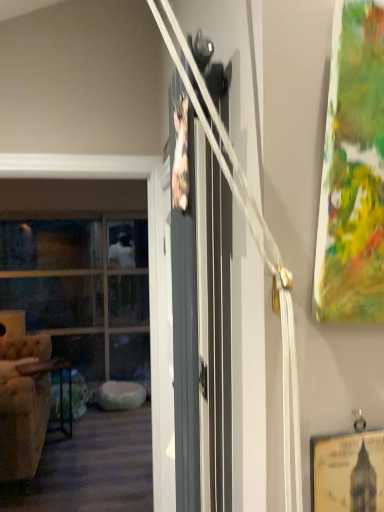
Question: Is metallic dark brown table at left to the left of clear glass window at left from the viewer's perspective?

Choices:
 (A) yes
 (B) no

Answer: (B)

Question: Considering the relative sizes of metallic dark brown table at left and clear glass window at left in the image provided, is metallic dark brown table at left wider than clear glass window at left?

Choices:
 (A) no
 (B) yes

Answer: (A)

Question: From the image's perspective, does metallic dark brown table at left appear lower than clear glass window at left?

Choices:
 (A) no
 (B) yes

Answer: (B)

Question: Does metallic dark brown table at left come in front of clear glass window at left?

Choices:
 (A) yes
 (B) no

Answer: (A)

Question: From the image's perspective, is metallic dark brown table at left on top of clear glass window at left?

Choices:
 (A) yes
 (B) no

Answer: (B)

Question: Do you think clear glass window at left is within matte gray barn door at center, or outside of it?

Choices:
 (A) outside
 (B) inside

Answer: (A)

Question: From a real-world perspective, is clear glass window at left physically located above or below matte gray barn door at center?

Choices:
 (A) below
 (B) above

Answer: (A)

Question: In the image, is clear glass window at left positioned in front of or behind matte gray barn door at center?

Choices:
 (A) front
 (B) behind

Answer: (B)

Question: From the image's perspective, relative to matte gray barn door at center, is clear glass window at left above or below?

Choices:
 (A) above
 (B) below

Answer: (B)

Question: Considering their positions, is beige tufted armchair at left located in front of or behind clear glass window at left?

Choices:
 (A) front
 (B) behind

Answer: (A)

Question: In terms of width, does beige tufted armchair at left look wider or thinner when compared to clear glass window at left?

Choices:
 (A) thin
 (B) wide

Answer: (A)

Question: From the image's perspective, relative to clear glass window at left, is beige tufted armchair at left above or below?

Choices:
 (A) above
 (B) below

Answer: (B)

Question: Do you think beige tufted armchair at left is within clear glass window at left, or outside of it?

Choices:
 (A) outside
 (B) inside

Answer: (A)

Question: Is matte gray barn door at center inside the boundaries of beige tufted armchair at left, or outside?

Choices:
 (A) outside
 (B) inside

Answer: (A)

Question: Would you say matte gray barn door at center is to the left or to the right of beige tufted armchair at left in the picture?

Choices:
 (A) right
 (B) left

Answer: (A)